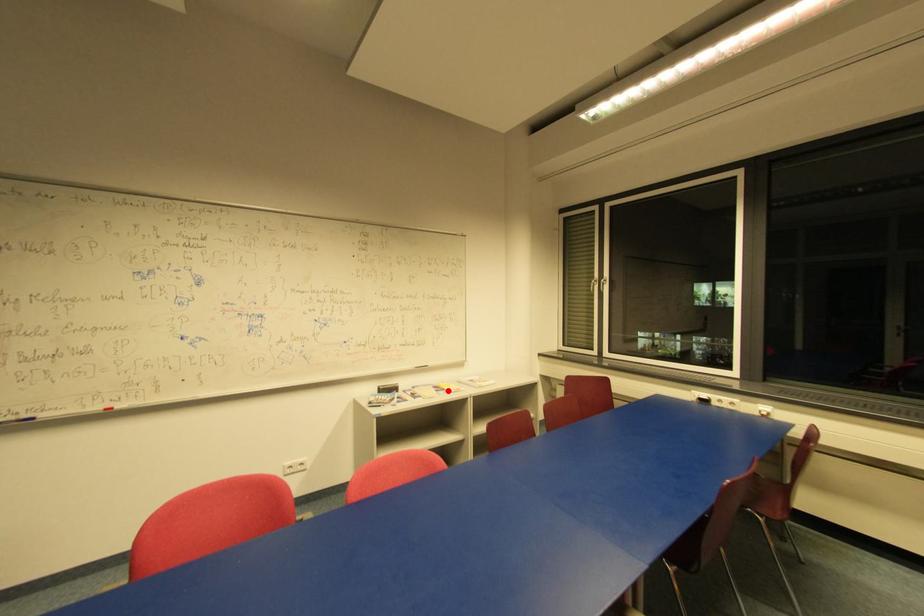
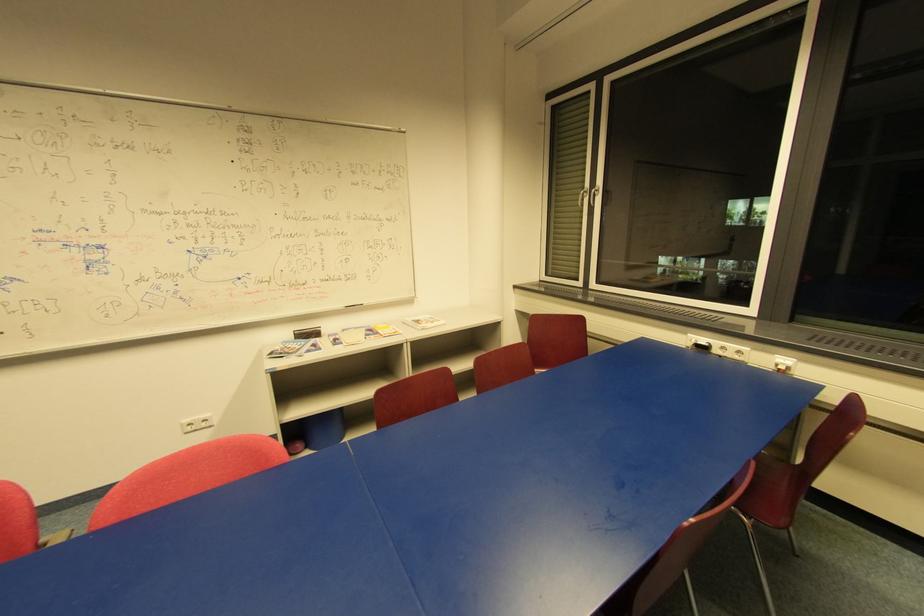
Question: I am providing you with two images of the same scene from different viewpoints. A red point is marked on the first image. At the location where the point appears in image 1, is it still visible in image 2?

Choices:
 (A) Yes
 (B) No

Answer: (A)